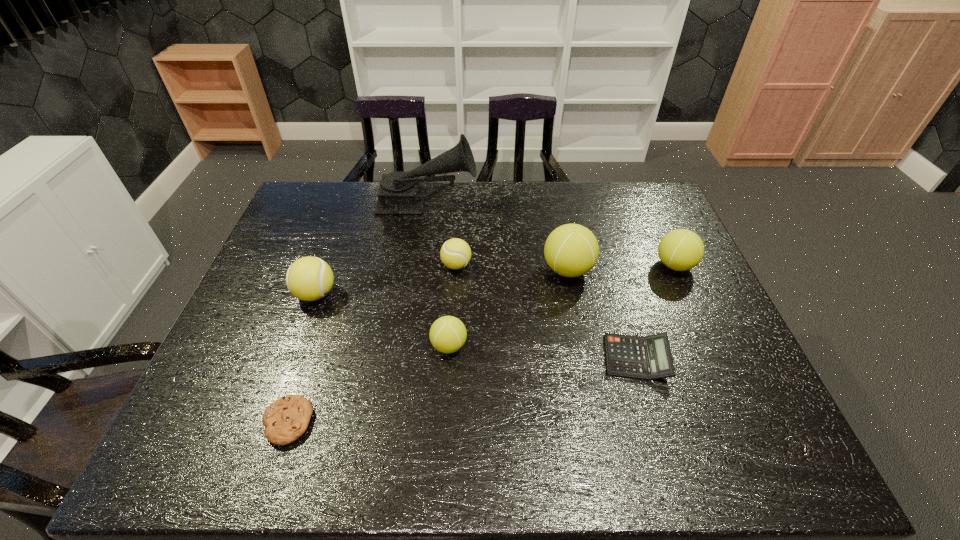
Where is `the leftmost green tennis ball`? The width and height of the screenshot is (960, 540). the leftmost green tennis ball is located at coordinates (448, 334).

Identify the location of the smallest green tennis ball. (448, 334).

Where is `the second shortest object`? The width and height of the screenshot is (960, 540). the second shortest object is located at coordinates (647, 358).

At what (x,y) coordinates should I click in order to perform the action: click on the shortest object. Please return your answer as a coordinate pair (x, y). The width and height of the screenshot is (960, 540). Looking at the image, I should click on (287, 418).

Locate an element on the screen. the nearest object is located at coordinates (287, 418).

The height and width of the screenshot is (540, 960). Identify the location of free region located from the horn of the tallest object. (509, 203).

Locate an element on the screen. vacant region located on the right of the biggest green tennis ball is located at coordinates (689, 270).

You are a GUI agent. You are given a task and a screenshot of the screen. Output one action in this format:
    pyautogui.click(x=<x>, y=<y>)
    Task: Click on the free space located on the right of the left yellow tennis ball
    
    Given the screenshot: What is the action you would take?
    pyautogui.click(x=428, y=294)

Find the location of a particular element. vacant space located 0.260m on the front of the rightmost object is located at coordinates (715, 356).

Locate an element on the screen. The width and height of the screenshot is (960, 540). free location located on the back of the smaller yellow tennis ball is located at coordinates (461, 186).